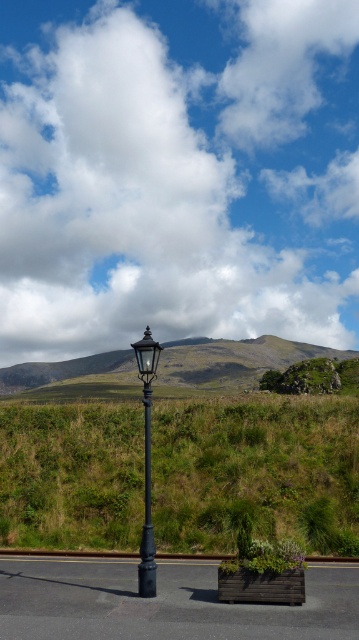
Is black polished street light at center taller than black metal pole at center?

Yes.

Which is more to the left, black polished street light at center or black metal pole at center?

Positioned to the left is black polished street light at center.

This screenshot has height=640, width=359. Describe the element at coordinates (146, 460) in the screenshot. I see `black polished street light at center` at that location.

I want to click on black polished street light at center, so click(x=146, y=460).

Consider the image. Can you confirm if green grassy hillside at center is smaller than black metal pole at center?

Actually, green grassy hillside at center might be larger than black metal pole at center.

Is green grassy hillside at center to the left of black metal pole at center from the viewer's perspective?

No, green grassy hillside at center is not to the left of black metal pole at center.

Locate an element on the screen. This screenshot has height=640, width=359. green grassy hillside at center is located at coordinates (234, 360).

Which is above, white fluffy cloud at upper center or green grassy at center?

white fluffy cloud at upper center is higher up.

Between white fluffy cloud at upper center and green grassy at center, which one appears on the right side from the viewer's perspective?

green grassy at center is more to the right.

Does point (283, 13) come farther from viewer compared to point (119, 506)?

Yes, point (283, 13) is behind point (119, 506).

Identify the location of white fluffy cloud at upper center. (176, 172).